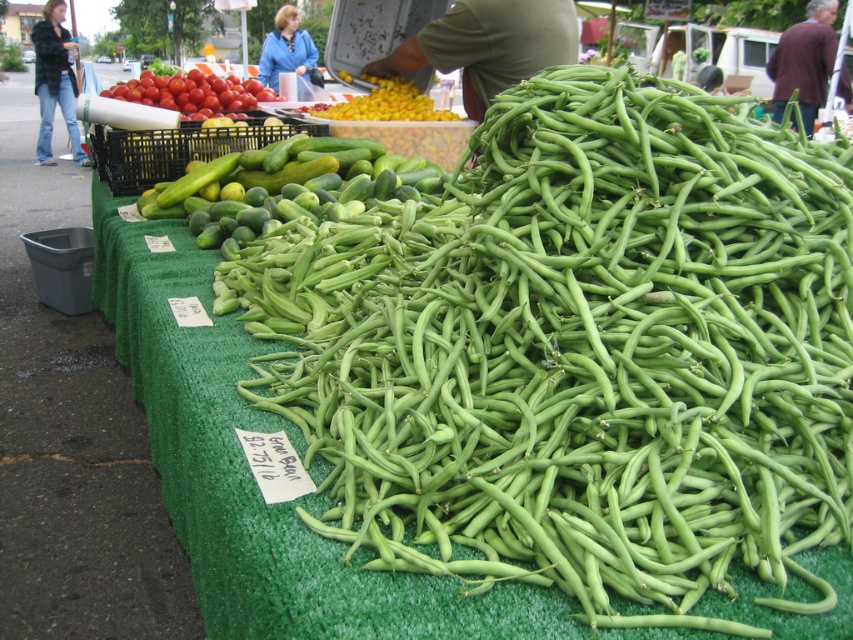
Looking at this image, you are a customer at the market and want to pick up both items located at point (271, 216) and point (173, 76). Which item should you reach for first to minimize the distance you have to move your hand?

You should reach for the item at point (271, 216) first because it is closer to you than the item at point (173, 76).

You are a customer at the market and want to buy both the green smooth skin cucumber at center and the shiny red tomatoes at upper left. Which item is located to the right of the other?

The green smooth skin cucumber at center is to the right of the shiny red tomatoes at upper left.

You are a customer at the market and want to buy vegetables. You see the green smooth beans at center and the green smooth skin cucumber at center. Which one is bigger in size?

The green smooth beans at center has a larger size compared to the green smooth skin cucumber at center.